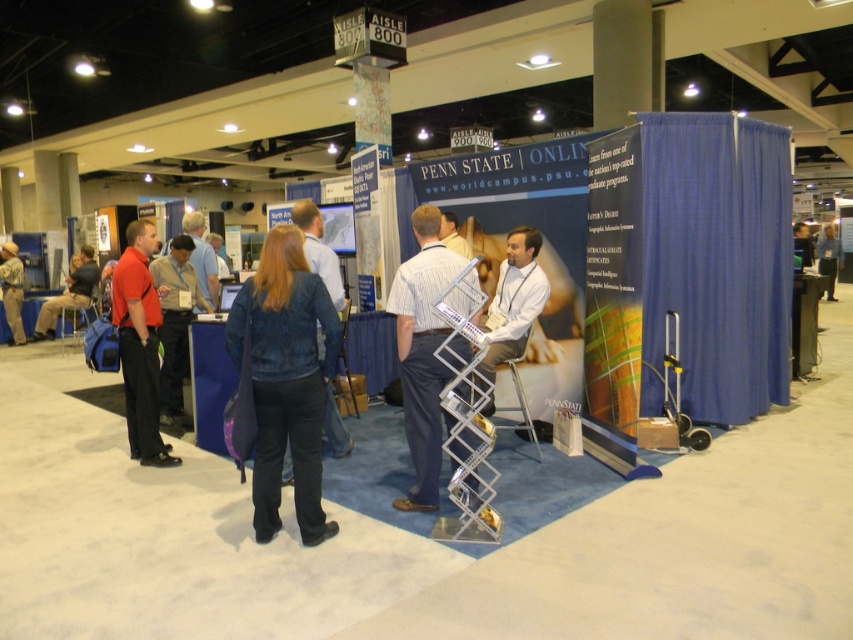
What do you see at coordinates (286, 378) in the screenshot?
I see `denim jacket at center` at bounding box center [286, 378].

Based on the photo, does denim jacket at center have a greater height compared to matte red shirt at left?

No.

Who is more forward, (x=289, y=316) or (x=129, y=234)?

Point (x=289, y=316)

Locate an element on the screen. This screenshot has width=853, height=640. denim jacket at center is located at coordinates (286, 378).

Is the position of denim jacket at center more distant than that of denim jacket at left?

No, it is in front of denim jacket at left.

Which is behind, point (305, 540) or point (68, 301)?

Point (68, 301)

You are a GUI agent. You are given a task and a screenshot of the screen. Output one action in this format:
    pyautogui.click(x=<x>, y=<y>)
    Task: Click on the denim jacket at center
    This screenshot has height=640, width=853.
    Given the screenshot: What is the action you would take?
    pyautogui.click(x=286, y=378)

Does white shirt at center have a greater width compared to blue shirt at center?

No, white shirt at center is not wider than blue shirt at center.

Is point (506, 250) farther from viewer compared to point (834, 256)?

That is False.

Locate an element on the screen. white shirt at center is located at coordinates (514, 300).